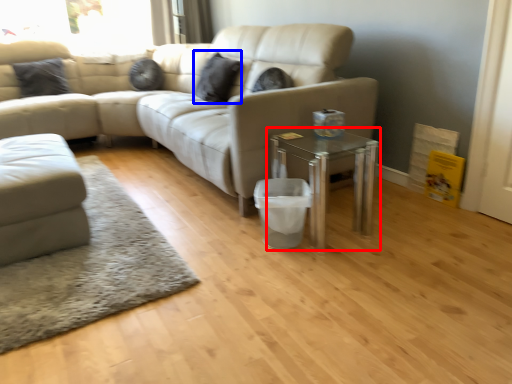
Question: Which object is further to the camera taking this photo, table (highlighted by a red box) or pillow (highlighted by a blue box)?

Choices:
 (A) table
 (B) pillow

Answer: (B)